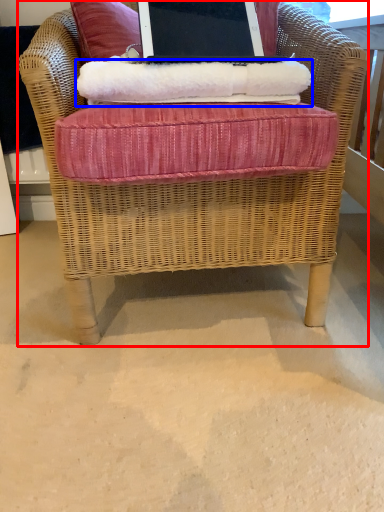
Question: Which object appears farthest to the camera in this image, chair (highlighted by a red box) or material (highlighted by a blue box)?

Choices:
 (A) chair
 (B) material

Answer: (B)